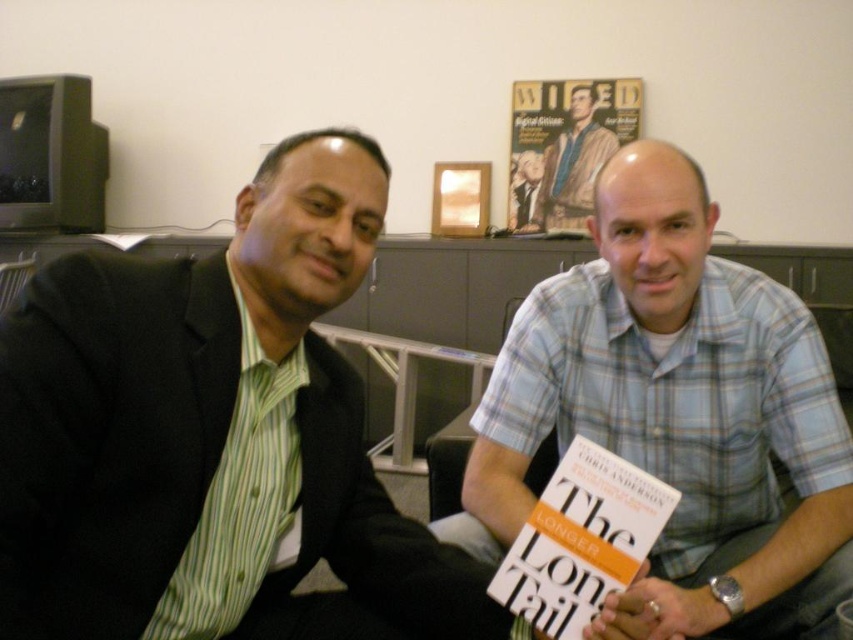
You are a photographer trying to capture the matte black suit at left in the image. The camera has a focus point at coordinate point (210, 432). Will this focus point be effective for capturing the matte black suit at left?

Yes, the focus point at (210, 432) corresponds to the matte black suit at left, so it will effectively capture the matte black suit at left.